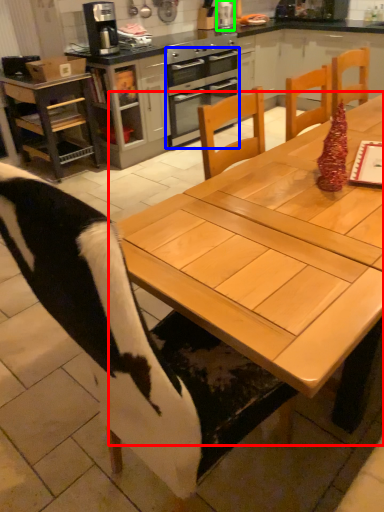
Question: Which object is positioned farthest from table (highlighted by a red box)? Select from oven (highlighted by a blue box) and appliance (highlighted by a green box).

Choices:
 (A) oven
 (B) appliance

Answer: (B)